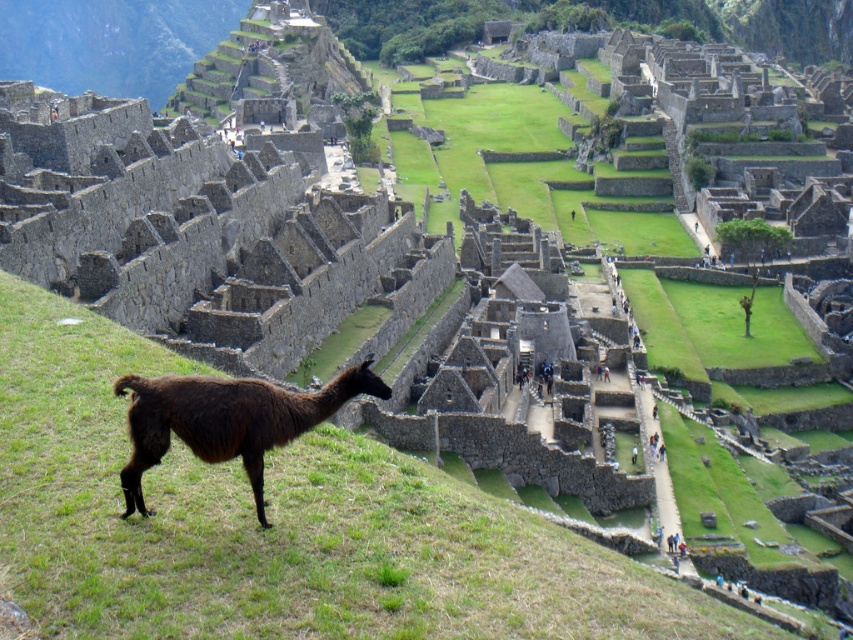
You are a tour guide at Machu Picchu and want to inform visitors about the distance between the stone ruins at center and the brown woolly alpaca at lower left. How far apart are they?

The stone ruins at center are 79.43 feet away from the brown woolly alpaca at lower left.

You are standing at the point with coordinates point (201, 232) in the Machu Picchu ruins. What structure are you standing on?

You are standing on the stone ruins at center corresponding to point (201, 232).